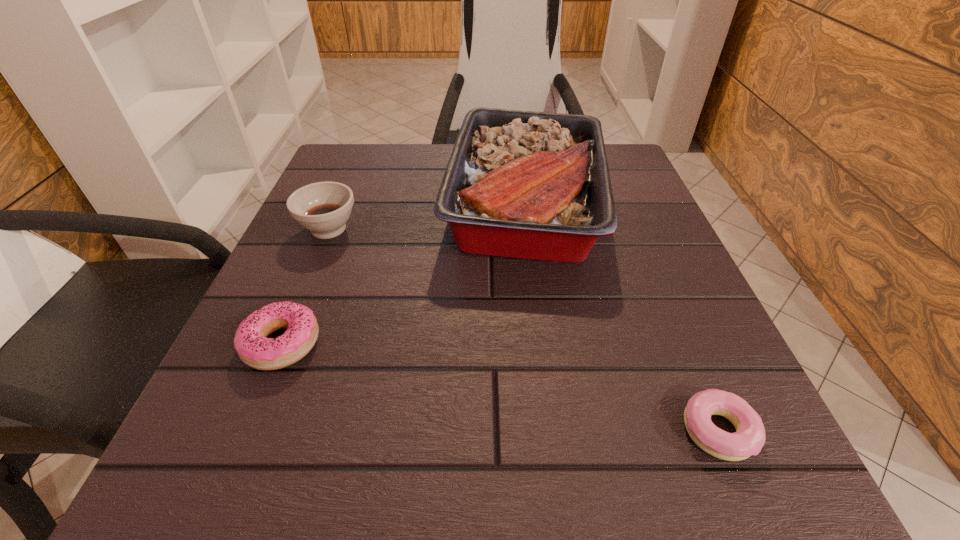
Identify the location of object that is at the far edge. This screenshot has width=960, height=540. (533, 185).

The width and height of the screenshot is (960, 540). I want to click on object at the near edge, so click(749, 438).

Where is `soup bowl at the left edge`? soup bowl at the left edge is located at coordinates (323, 208).

Identify the location of doughnut that is at the left edge. The width and height of the screenshot is (960, 540). (253, 347).

Locate an element on the screen. The width and height of the screenshot is (960, 540). tray positioned at the right edge is located at coordinates (533, 185).

You are a GUI agent. You are given a task and a screenshot of the screen. Output one action in this format:
    pyautogui.click(x=<x>, y=<y>)
    Task: Click on the doughnut that is positioned at the right edge
    The height and width of the screenshot is (540, 960).
    Given the screenshot: What is the action you would take?
    pyautogui.click(x=749, y=438)

The width and height of the screenshot is (960, 540). Identify the location of object at the far right corner. (533, 185).

Locate an element on the screen. object that is positioned at the near right corner is located at coordinates (749, 438).

At what (x,y) coordinates should I click in order to perform the action: click on vacant space at the far edge of the desktop. Please return your answer as a coordinate pair (x, y). Looking at the image, I should click on (449, 154).

Where is `free space at the left edge of the desktop`? Image resolution: width=960 pixels, height=540 pixels. free space at the left edge of the desktop is located at coordinates (x=356, y=220).